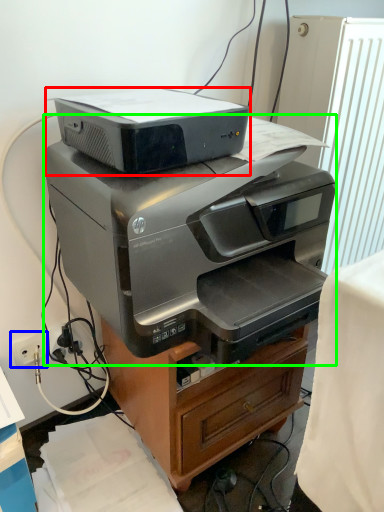
Question: Considering the real-world distances, which object is closest to printer (highlighted by a red box)? electric outlet (highlighted by a blue box) or printer (highlighted by a green box).

Choices:
 (A) electric outlet
 (B) printer

Answer: (B)